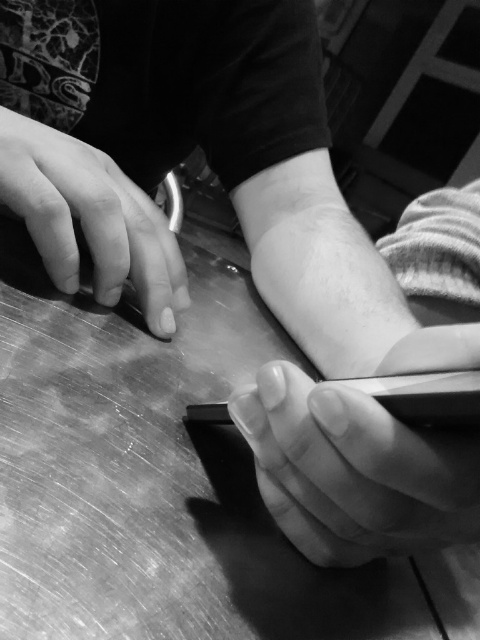
You are a photographer analyzing the composition of this black and white photo. You notice two areas of smooth skin at lower right and smooth skin at left. Which area is closer to the camera based on their positions?

The smooth skin at lower right is closer to the camera because it is in front of the smooth skin at left.